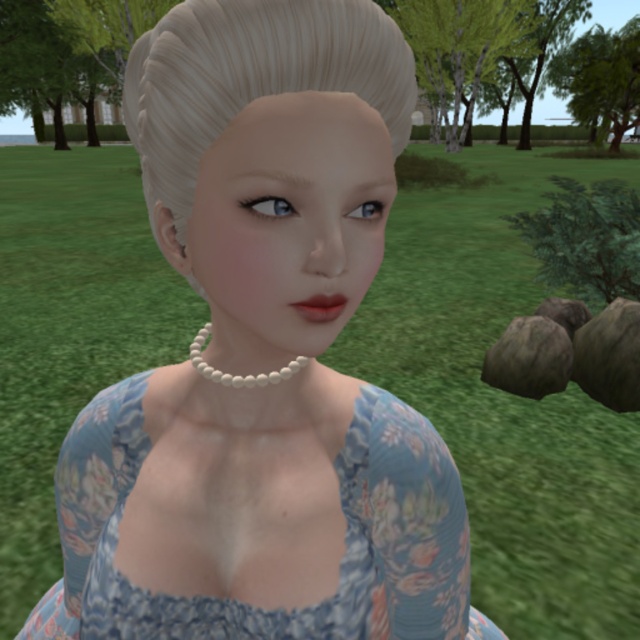
Is blue floral fabric dress at center to the left of blonde smooth hair at center from the viewer's perspective?

Correct, you'll find blue floral fabric dress at center to the left of blonde smooth hair at center.

Based on the photo, measure the distance between point [362,637] and camera.

Point [362,637] and camera are 20.40 inches apart.

The height and width of the screenshot is (640, 640). What are the coordinates of `blue floral fabric dress at center` in the screenshot? It's located at (344, 536).